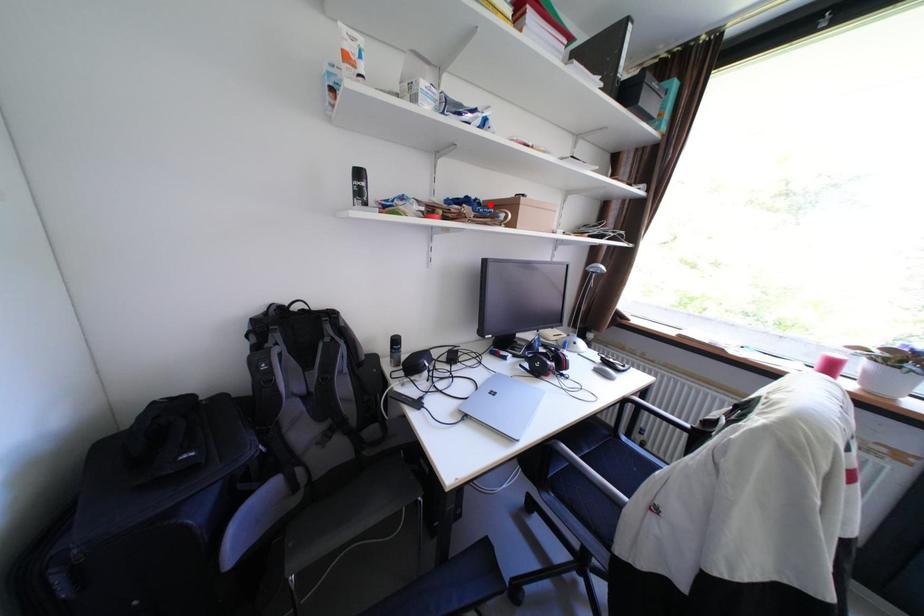
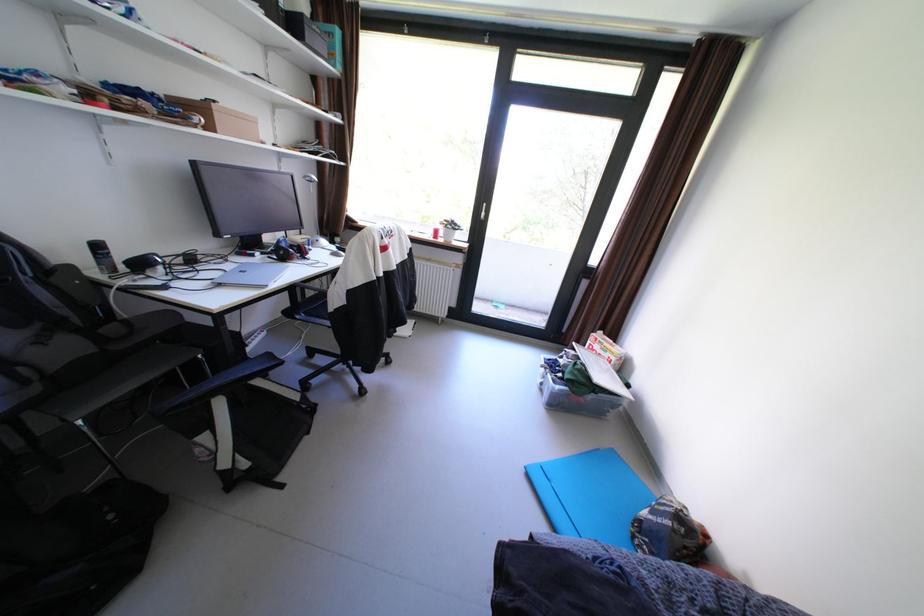
The point at the highlighted location is marked in the first image. Where is the corresponding point in the second image?

(172, 100)